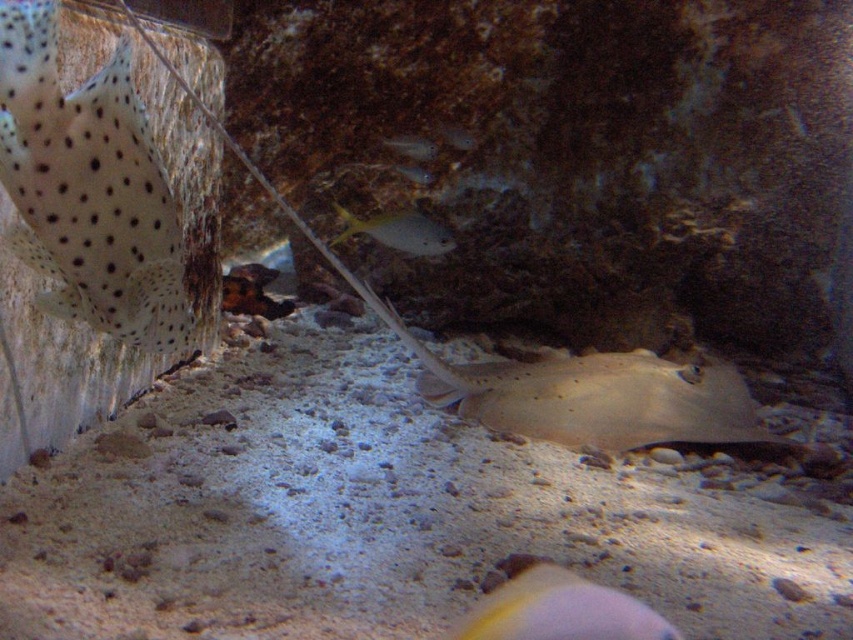
Question: Which object appears farthest from the camera in this image?

Choices:
 (A) smooth yellow fish at lower center
 (B) spotted white at left
 (C) yellow shiny fish at center

Answer: (C)

Question: Which point is closer to the camera?

Choices:
 (A) (421, 230)
 (B) (412, 150)

Answer: (A)

Question: Among these points, which one is nearest to the camera?

Choices:
 (A) (451, 131)
 (B) (86, 104)
 (C) (532, 628)

Answer: (C)

Question: Can you confirm if yellow shiny fish at center is positioned below translucent yellow fish at center?

Choices:
 (A) yes
 (B) no

Answer: (A)

Question: Is spotted white at left below yellow shiny fish at center?

Choices:
 (A) no
 (B) yes

Answer: (B)

Question: Can you confirm if yellow shiny fish at center is wider than shiny silver fish at center?

Choices:
 (A) no
 (B) yes

Answer: (B)